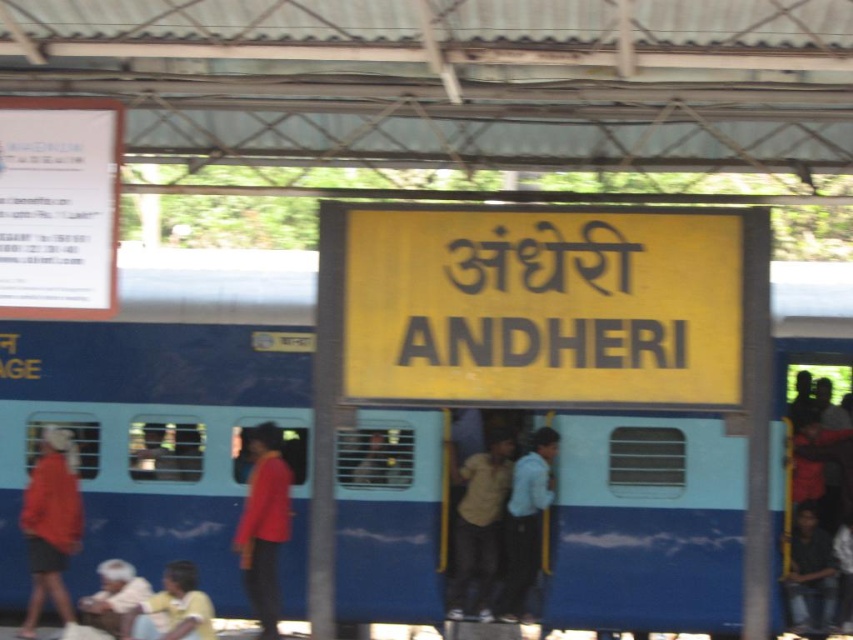
Question: Is blue metallic train at center below yellow matte sign at center?

Choices:
 (A) yes
 (B) no

Answer: (A)

Question: Is yellow fabric shirt at lower left to the left of white fabric headscarf at lower left from the viewer's perspective?

Choices:
 (A) yes
 (B) no

Answer: (B)

Question: Which point appears closest to the camera in this image?

Choices:
 (A) (245, 544)
 (B) (799, 609)

Answer: (A)

Question: Which object appears closest to the camera in this image?

Choices:
 (A) matte red shirt at center
 (B) light brown fabric shirt at center

Answer: (A)

Question: Is white paper at upper left further to the viewer compared to matte red dress at left?

Choices:
 (A) yes
 (B) no

Answer: (B)

Question: Which of the following is the farthest from the observer?

Choices:
 (A) (473, 550)
 (B) (102, 150)
 (C) (144, 538)

Answer: (A)